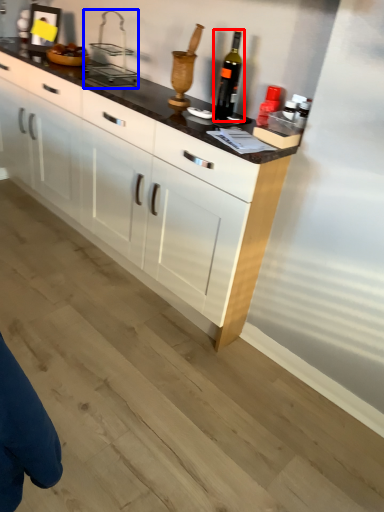
Question: Which point is closer to the camera, wine bottle (highlighted by a red box) or appliance (highlighted by a blue box)?

Choices:
 (A) wine bottle
 (B) appliance

Answer: (A)